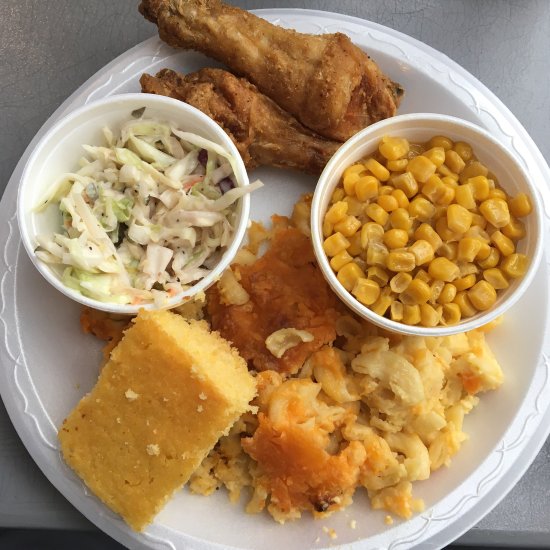
Where is `crumb`? The width and height of the screenshot is (550, 550). crumb is located at coordinates (331, 533).